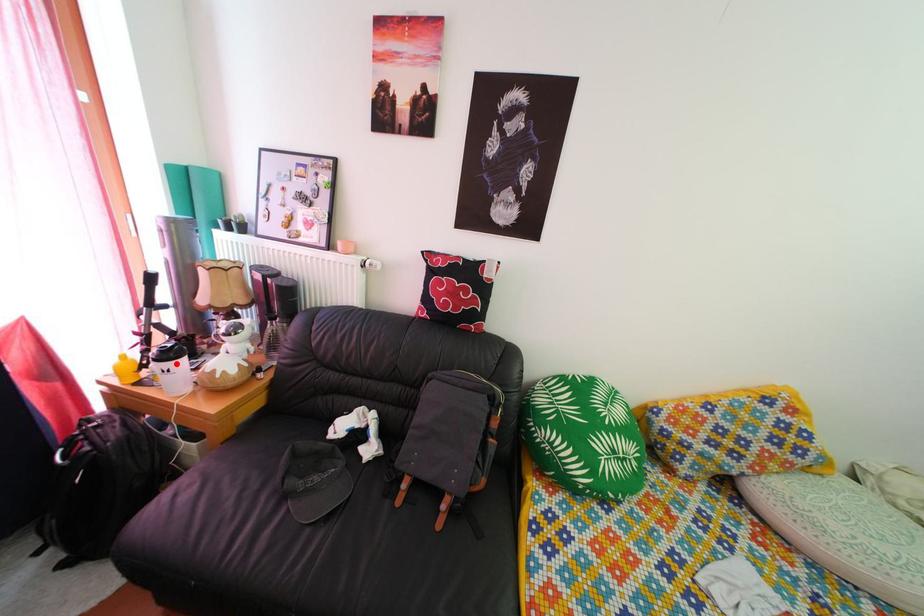
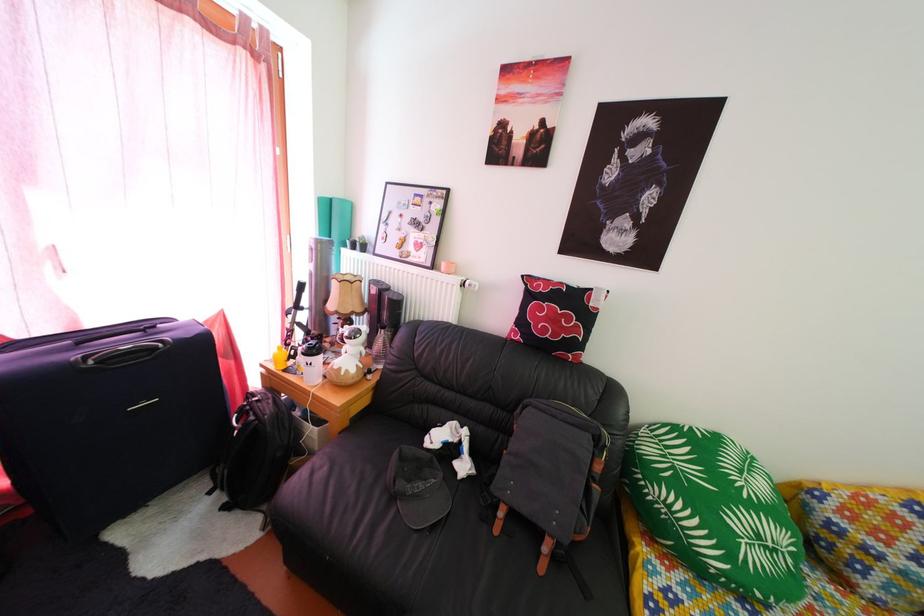
The point at the highlighted location is marked in the first image. Where is the corresponding point in the second image?

(321, 360)